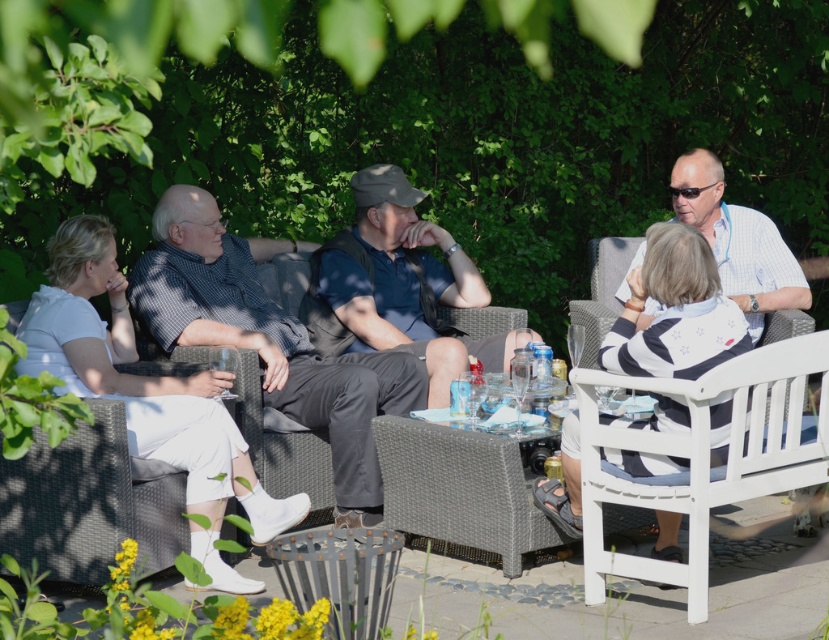
Who is more distant from viewer, (49, 493) or (464, 301)?

Point (464, 301)

Identify the location of white wicker chair at center. (90, 500).

Where is `white wicker chair at center`? This screenshot has width=829, height=640. white wicker chair at center is located at coordinates (90, 500).

What do you see at coordinates (270, 340) in the screenshot? The height and width of the screenshot is (640, 829). I see `matte black shirt at left` at bounding box center [270, 340].

Between matte black shirt at left and white wicker chair at center, which one has more height?

matte black shirt at left

Locate an element on the screen. Image resolution: width=829 pixels, height=640 pixels. matte black shirt at left is located at coordinates (270, 340).

Locate an element on the screen. This screenshot has height=640, width=829. matte black shirt at left is located at coordinates (270, 340).

Is white wood bench at lower right below light blue checkered shirt at upper right?

Indeed, white wood bench at lower right is positioned under light blue checkered shirt at upper right.

Does white wood bench at lower right have a lesser width compared to light blue checkered shirt at upper right?

Incorrect, white wood bench at lower right's width is not less than light blue checkered shirt at upper right's.

At what (x,y) coordinates should I click in order to perform the action: click on white wood bench at lower right. Please return your answer as a coordinate pair (x, y). The height and width of the screenshot is (640, 829). Looking at the image, I should click on (704, 456).

At what (x,y) coordinates should I click in order to perform the action: click on white wood bench at lower right. Please return your answer as a coordinate pair (x, y). Looking at the image, I should click on (704, 456).